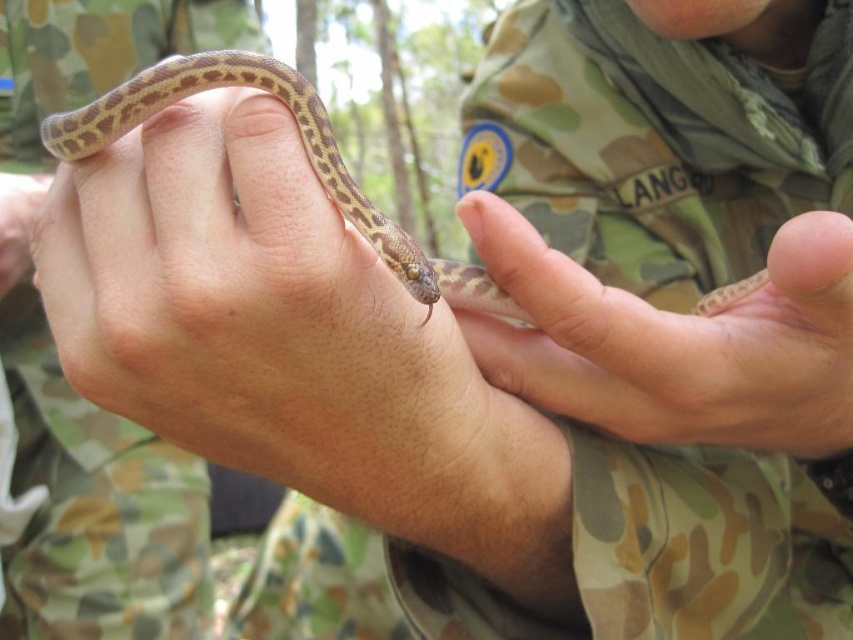
Question: Can you confirm if smooth skin hand at center is positioned below brown spotted skin at center?

Choices:
 (A) yes
 (B) no

Answer: (A)

Question: Which object is the closest to the brown matte snake at center?

Choices:
 (A) brown spotted skin at center
 (B) smooth skin hand at center

Answer: (A)

Question: Which point appears farthest from the camera in this image?

Choices:
 (A) (815, 321)
 (B) (73, 124)

Answer: (A)

Question: Is brown matte snake at center thinner than smooth skin hand at center?

Choices:
 (A) no
 (B) yes

Answer: (B)

Question: Can you confirm if smooth skin hand at center is wider than brown spotted skin at center?

Choices:
 (A) yes
 (B) no

Answer: (B)

Question: Which of the following is the farthest from the observer?

Choices:
 (A) (86, 170)
 (B) (764, 269)
 (C) (827, 264)

Answer: (B)